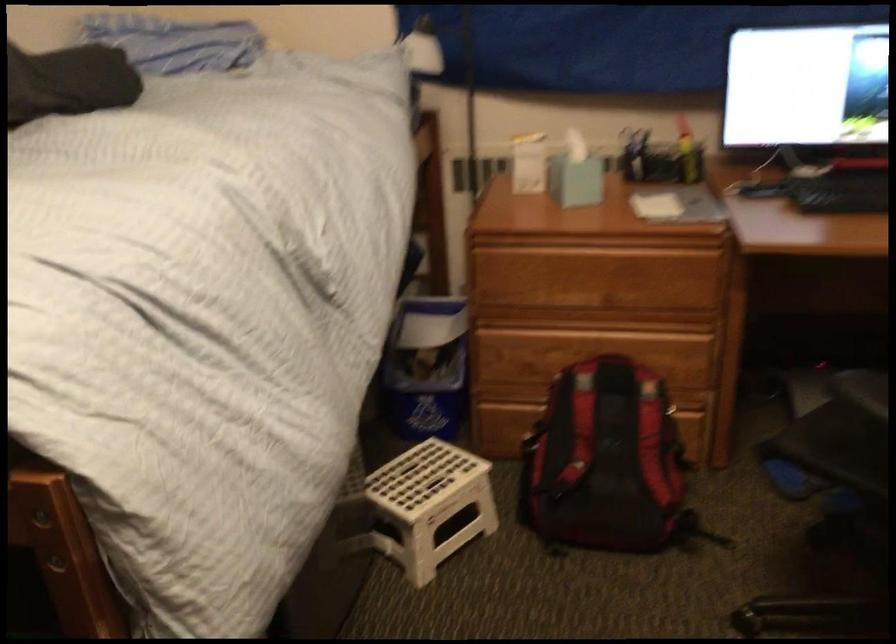
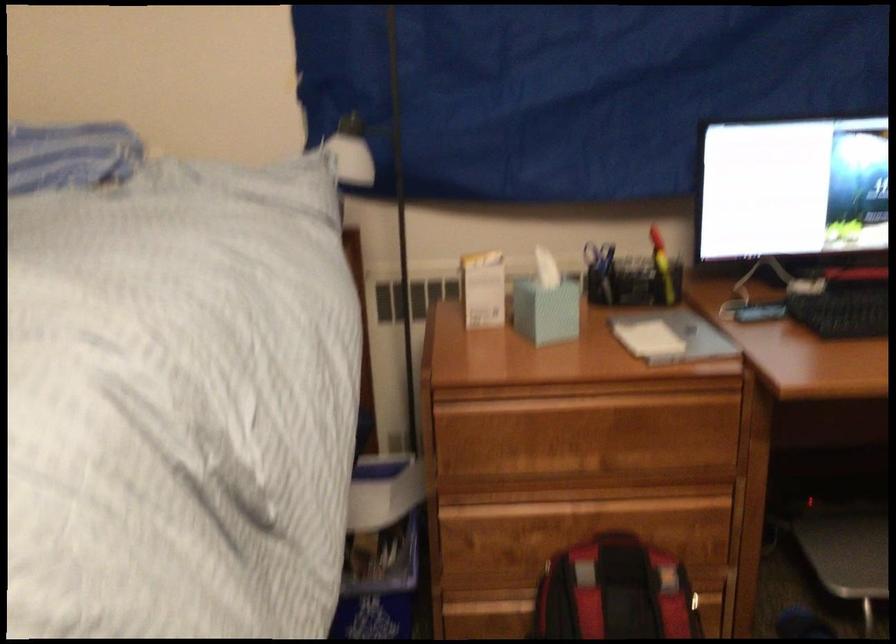
Where in the second image is the point corresponding to the point at 635,152 from the first image?

(599, 272)